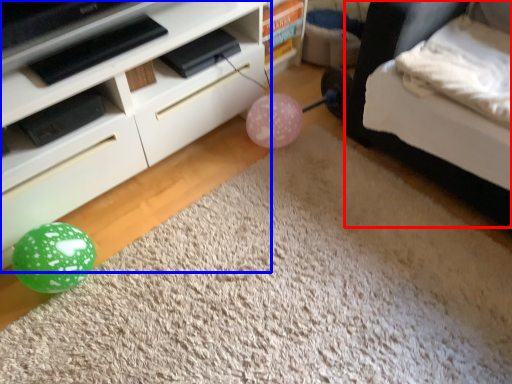
Question: Among these objects, which one is nearest to the camera, bed (highlighted by a red box) or furniture (highlighted by a blue box)?

Choices:
 (A) bed
 (B) furniture

Answer: (A)